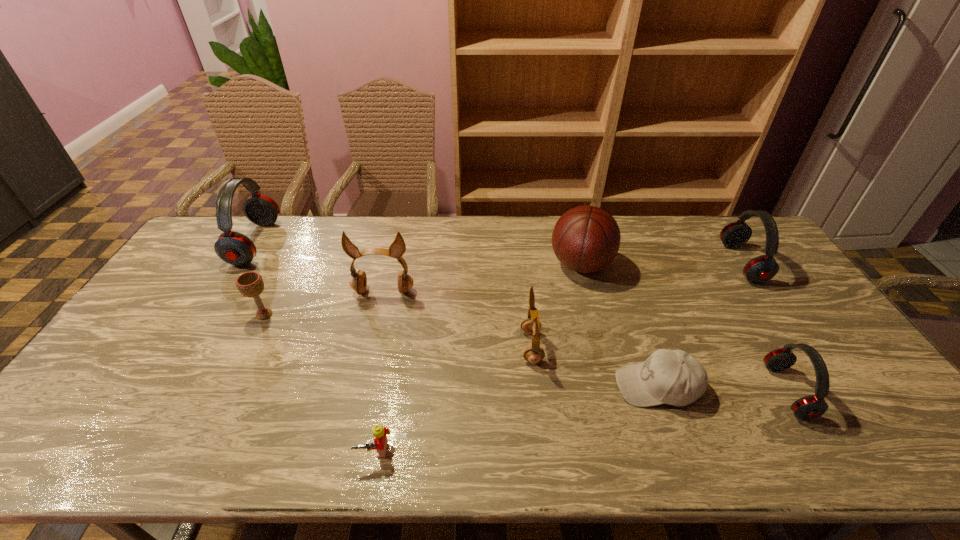
Where is `vacant space situated 0.130m on the ear cups of the rightmost earphone`? The width and height of the screenshot is (960, 540). vacant space situated 0.130m on the ear cups of the rightmost earphone is located at coordinates (688, 263).

Locate an element on the screen. vacant area located 0.090m on the front-facing side of the smaller brown earphone is located at coordinates (489, 347).

Locate an element on the screen. vacant space located 0.170m on the front-facing side of the smaller brown earphone is located at coordinates (460, 347).

Locate an element on the screen. The height and width of the screenshot is (540, 960). vacant space located on the front-facing side of the smaller brown earphone is located at coordinates (391, 347).

Where is `free space located 0.190m on the ear cups of the second earphone from right to left`? This screenshot has height=540, width=960. free space located 0.190m on the ear cups of the second earphone from right to left is located at coordinates (697, 392).

This screenshot has width=960, height=540. I want to click on vacant space located 0.120m on the ear cups of the second earphone from right to left, so click(725, 392).

Find the location of `free space located 0.350m on the ear cups of the second earphone from right to left`. free space located 0.350m on the ear cups of the second earphone from right to left is located at coordinates (634, 392).

The width and height of the screenshot is (960, 540). In order to click on vacant space located 0.190m on the back of the fifth nearest object in this screenshot , I will do `click(289, 266)`.

You are a GUI agent. You are given a task and a screenshot of the screen. Output one action in this format:
    pyautogui.click(x=<x>, y=<y>)
    Task: Click on the free location located on the front-facing side of the gray baseball cap
    The width and height of the screenshot is (960, 540).
    Given the screenshot: What is the action you would take?
    pyautogui.click(x=462, y=386)

What are the coordinates of `vacant point located 0.290m on the front-facing side of the gray baseball cap` in the screenshot? It's located at (501, 386).